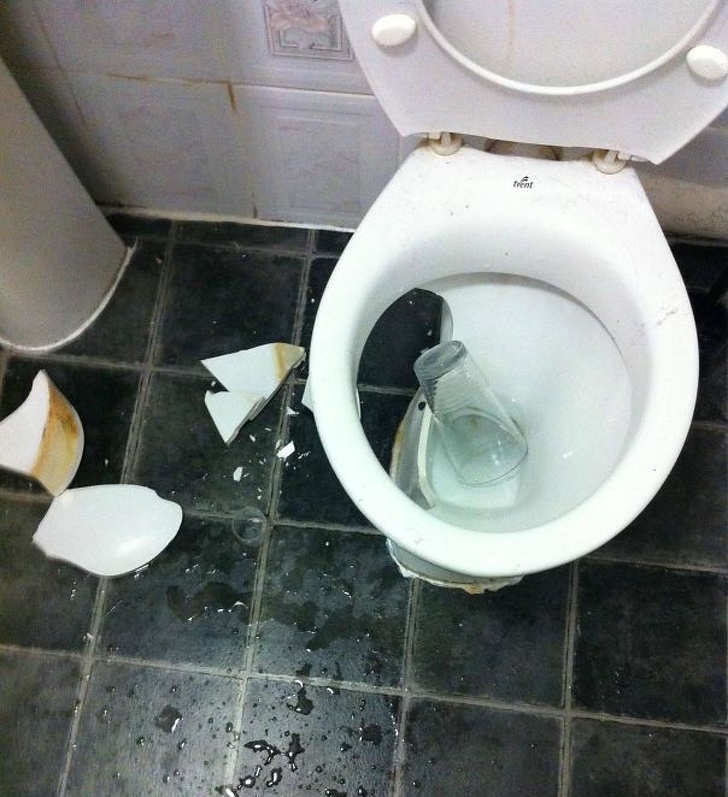
Identify the location of tile floor. Image resolution: width=728 pixels, height=797 pixels. (333, 720).